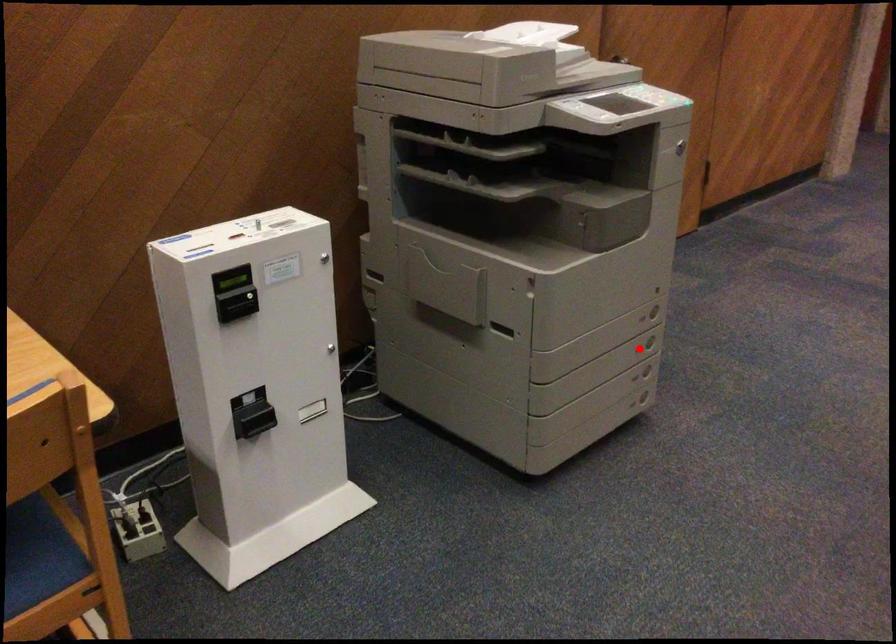
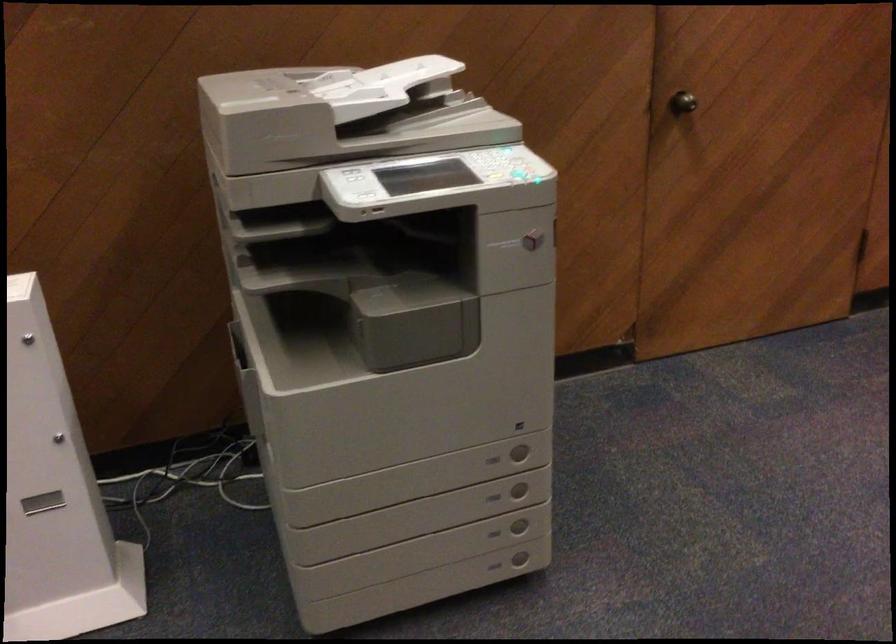
Question: I am providing you with two images of the same scene from different viewpoints. A red point is marked on the first image. Can you still see the location of the red point in image 2?

Choices:
 (A) Yes
 (B) No

Answer: (A)